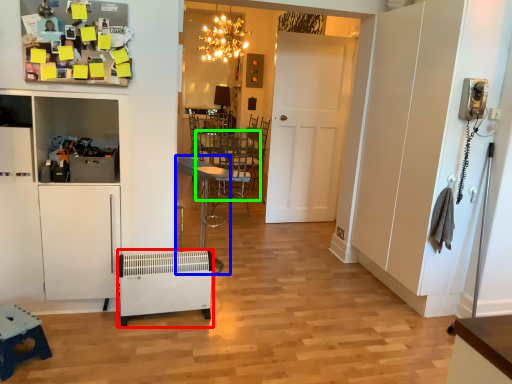
Question: Which is farther away from appliance (highlighted by a red box)? chair (highlighted by a blue box) or table (highlighted by a green box)?

Choices:
 (A) chair
 (B) table

Answer: (B)